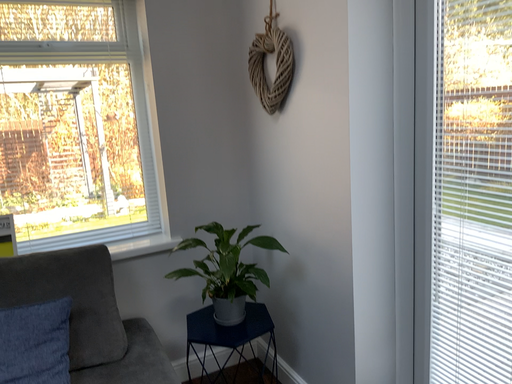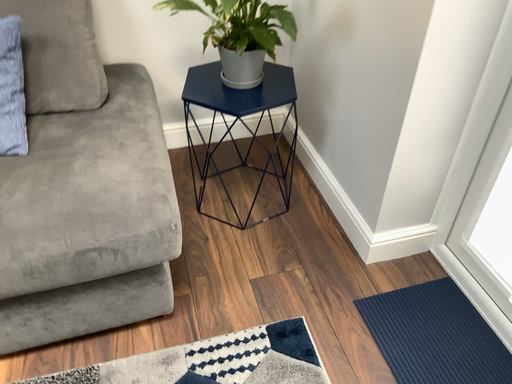
Question: How did the camera likely rotate when shooting the video?

Choices:
 (A) rotated upward
 (B) rotated downward

Answer: (B)